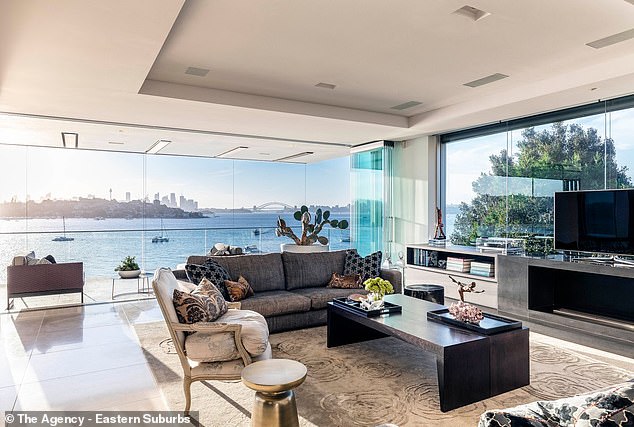
Where is `white ceiling`? The image size is (634, 427). white ceiling is located at coordinates (366, 49).